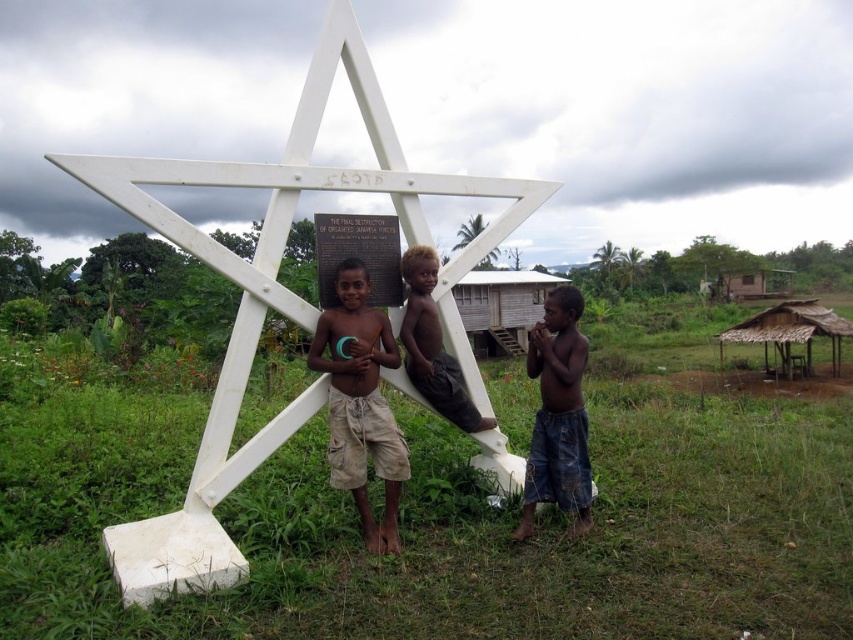
Who is more distant from viewer, (534,424) or (552,280)?

Positioned behind is point (552,280).

Does blue denim shorts at lower right lie behind wooden hut at center?

No, blue denim shorts at lower right is closer to the viewer.

Between point (567, 490) and point (488, 328), which one is positioned behind?

Positioned behind is point (488, 328).

Where is `blue denim shorts at lower right`? The width and height of the screenshot is (853, 640). blue denim shorts at lower right is located at coordinates (x=558, y=413).

Which is below, white matte star at center or beige cotton shorts at center?

beige cotton shorts at center

Can you confirm if white matte star at center is positioned to the left of beige cotton shorts at center?

Yes, white matte star at center is to the left of beige cotton shorts at center.

Describe the element at coordinates (277, 298) in the screenshot. I see `white matte star at center` at that location.

I want to click on white matte star at center, so click(277, 298).

Can you confirm if blue denim shorts at lower right is taller than brown wooden hut at right?

In fact, blue denim shorts at lower right may be shorter than brown wooden hut at right.

Is point (567, 464) closer to camera compared to point (787, 289)?

Yes, point (567, 464) is in front of point (787, 289).

I want to click on blue denim shorts at lower right, so click(558, 413).